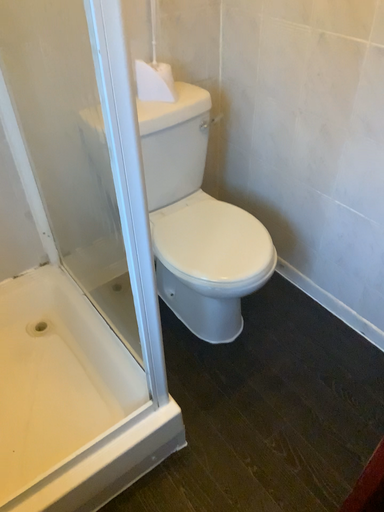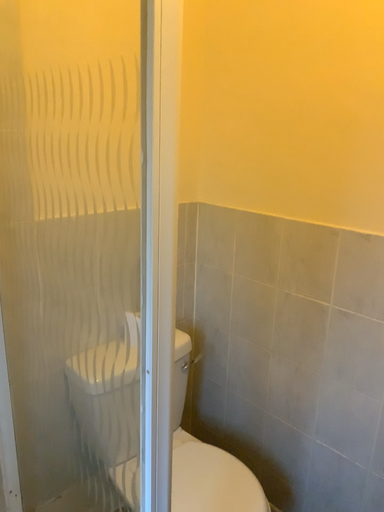
Question: How did the camera likely rotate when shooting the video?

Choices:
 (A) rotated right
 (B) rotated left

Answer: (A)